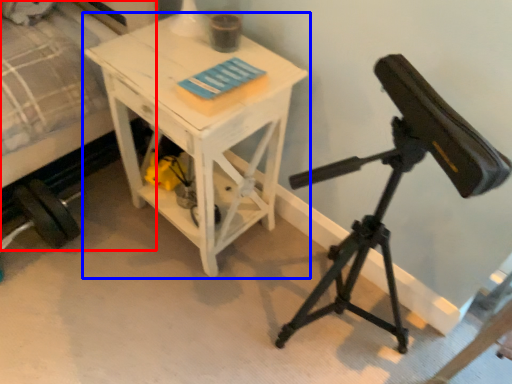
Question: Which object is further to the camera taking this photo, bed (highlighted by a red box) or table (highlighted by a blue box)?

Choices:
 (A) bed
 (B) table

Answer: (B)